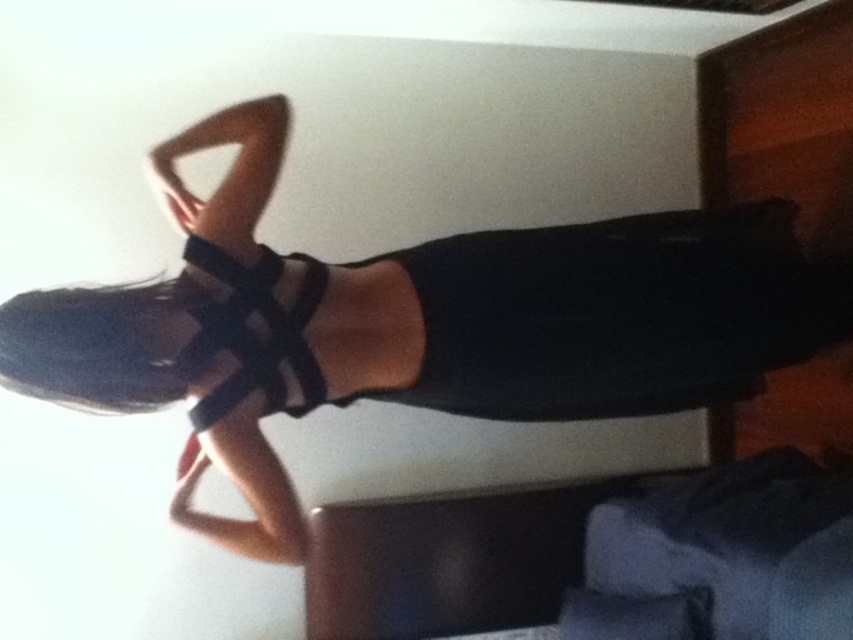
You are a fashion designer observing the image. You need to determine the placement of the matte black dress at center and the black mesh strap at center. Which object is positioned more to the left?

The black mesh strap at center is positioned more to the left than the matte black dress at center.

You are a fashion designer trying to fit a new accessory onto the dress. The accessory needs to be smaller than the dress to ensure it doesn not overwhelm the design. Given the matte black dress at center and the black mesh strap at center, which object should you choose to place the accessory on?

The accessory should be placed on the black mesh strap at center because it is smaller than the matte black dress at center, ensuring it won not overwhelm the design.